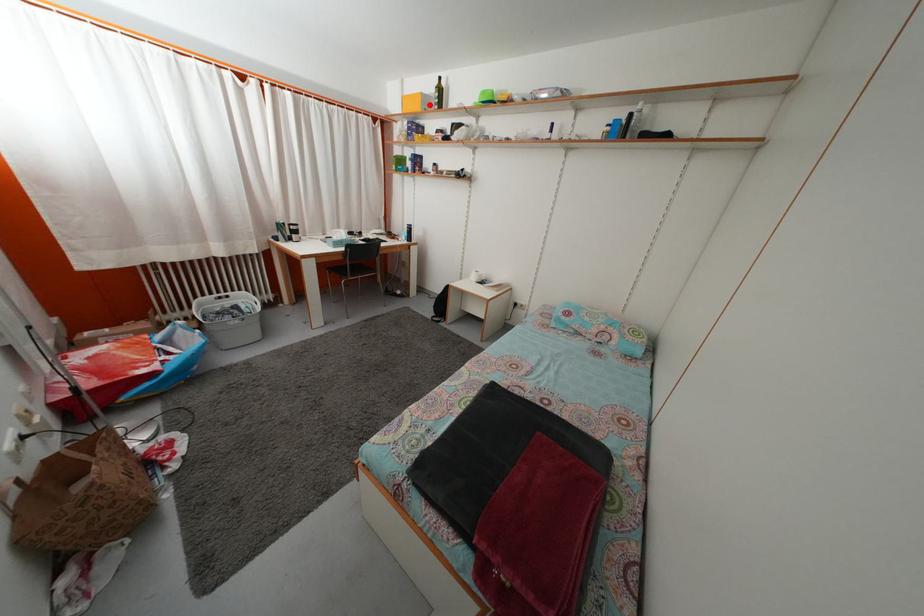
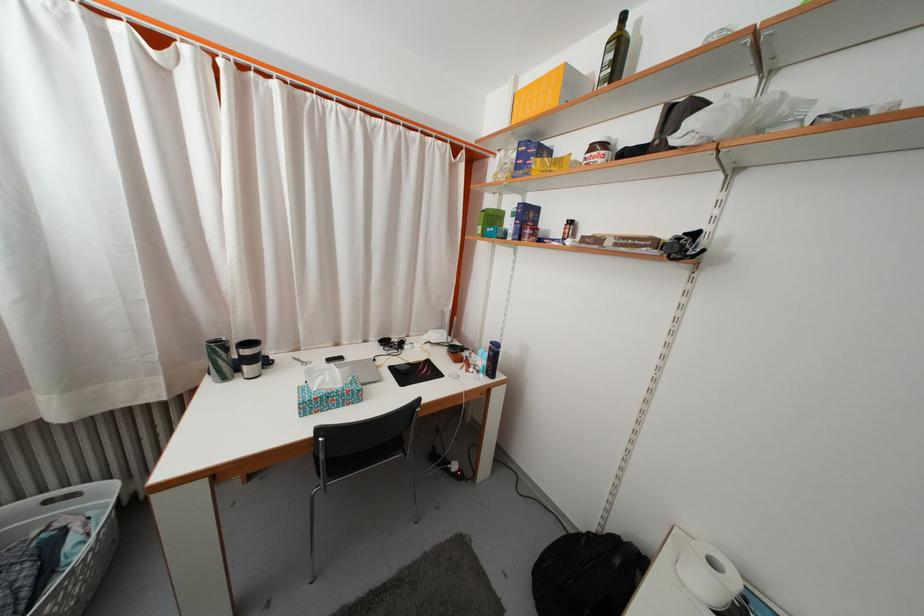
Question: I am providing you with two images of the same scene from different viewpoints. A red point is marked on the first image. Is the red point's position out of view in image 2?

Choices:
 (A) Yes
 (B) No

Answer: (B)